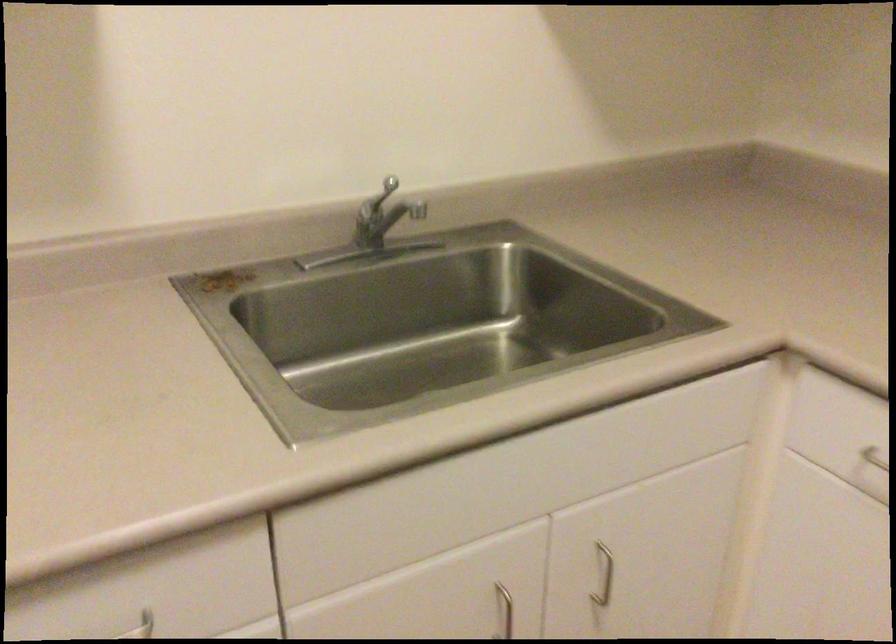
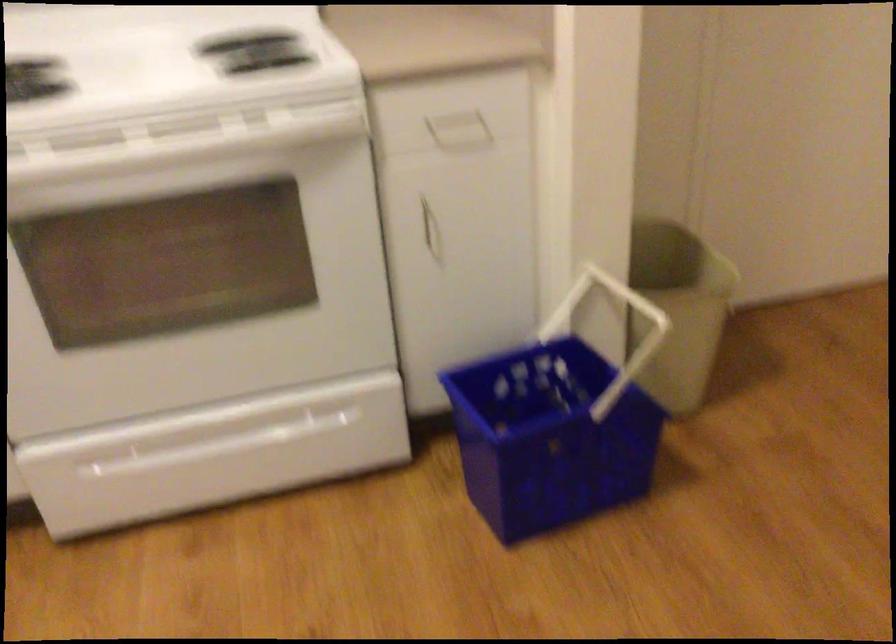
First-person continuous shooting, in which direction is the camera rotating?

The rotation direction of the camera is right-down.